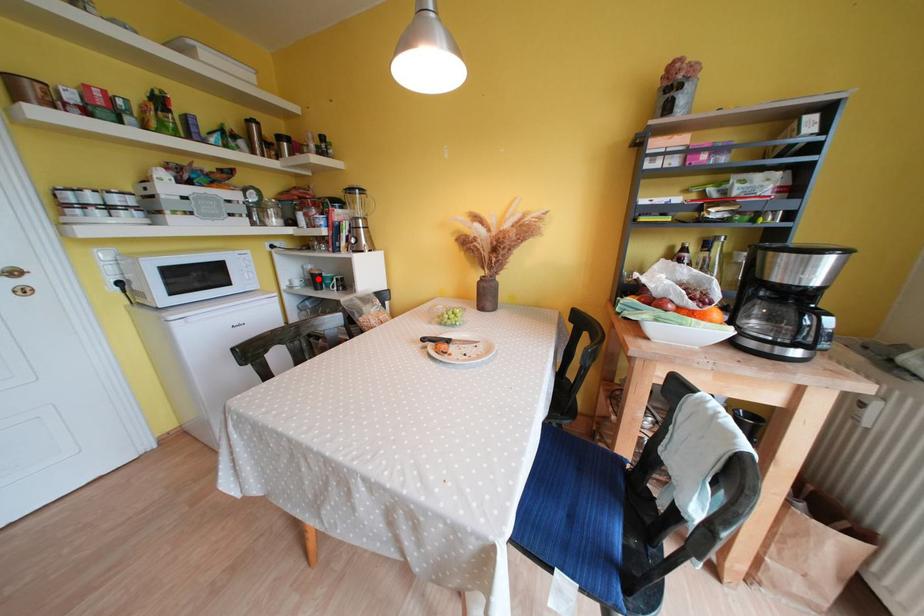
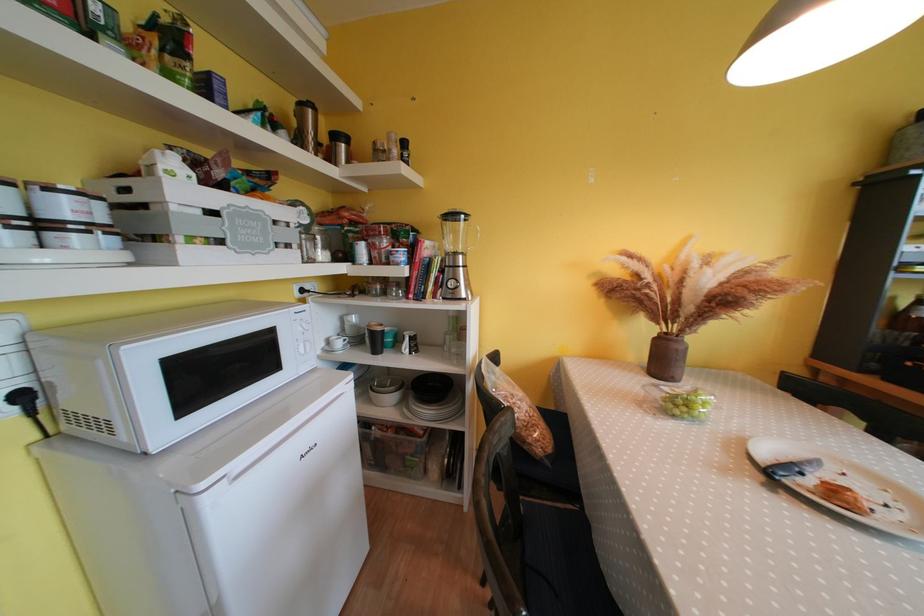
In the second image, find the point that corresponds to the highlighted location in the first image.

(379, 337)